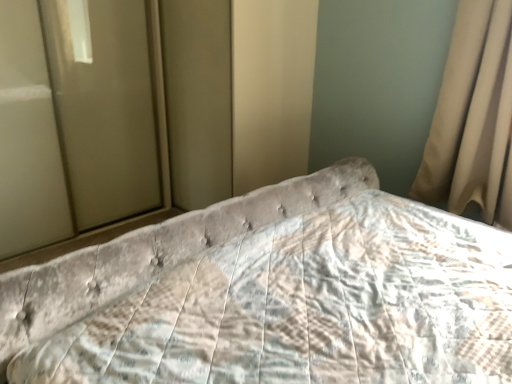
Question: Would you say beige fabric curtain at right is outside matte glass door at left?

Choices:
 (A) no
 (B) yes

Answer: (B)

Question: Is beige fabric curtain at right positioned with its back to matte glass door at left?

Choices:
 (A) yes
 (B) no

Answer: (B)

Question: Is beige fabric curtain at right directly adjacent to matte glass door at left?

Choices:
 (A) yes
 (B) no

Answer: (B)

Question: From the image's perspective, is beige fabric curtain at right located beneath matte glass door at left?

Choices:
 (A) no
 (B) yes

Answer: (B)

Question: Can you confirm if beige fabric curtain at right is taller than matte glass door at left?

Choices:
 (A) no
 (B) yes

Answer: (A)

Question: Is beige fabric curtain at right wider than matte glass door at left?

Choices:
 (A) yes
 (B) no

Answer: (B)

Question: Is beige fabric curtain at right smaller than velvet tufted headboard at center?

Choices:
 (A) yes
 (B) no

Answer: (A)

Question: Does beige fabric curtain at right have a greater width compared to velvet tufted headboard at center?

Choices:
 (A) yes
 (B) no

Answer: (B)

Question: Are beige fabric curtain at right and velvet tufted headboard at center far apart?

Choices:
 (A) yes
 (B) no

Answer: (B)

Question: Is beige fabric curtain at right at the right side of velvet tufted headboard at center?

Choices:
 (A) yes
 (B) no

Answer: (A)

Question: Can you confirm if beige fabric curtain at right is bigger than velvet tufted headboard at center?

Choices:
 (A) no
 (B) yes

Answer: (A)

Question: Is beige fabric curtain at right thinner than velvet tufted headboard at center?

Choices:
 (A) no
 (B) yes

Answer: (B)

Question: Is matte glass door at left facing towards velvet tufted headboard at center?

Choices:
 (A) yes
 (B) no

Answer: (A)